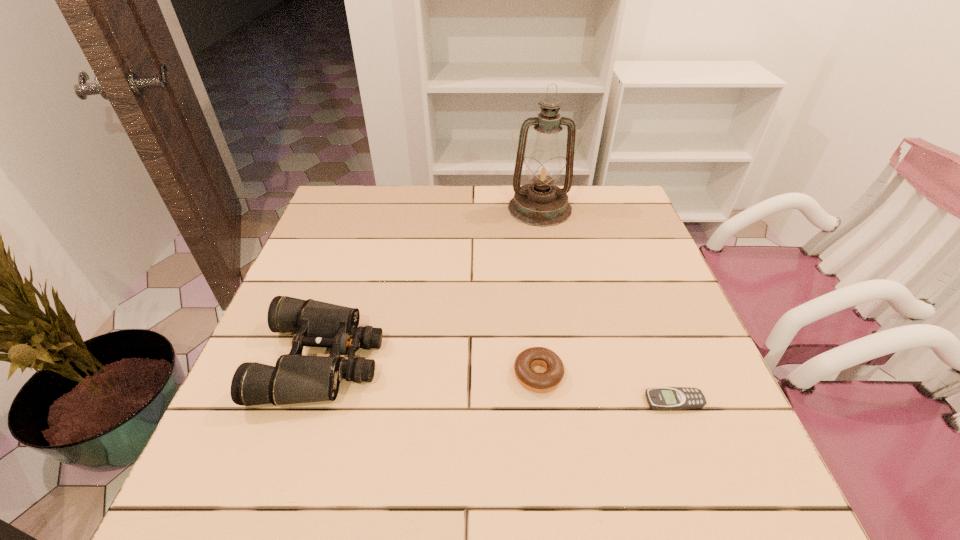
Locate an element on the screen. vacant space positioned 0.140m on the back of the rightmost object is located at coordinates (650, 338).

The width and height of the screenshot is (960, 540). In order to click on object that is at the far edge in this screenshot , I will do `click(540, 203)`.

This screenshot has width=960, height=540. I want to click on object located in the left edge section of the desktop, so click(x=296, y=378).

Locate an element on the screen. The width and height of the screenshot is (960, 540). object present at the right edge is located at coordinates (663, 398).

In the image, there is a desktop. Find the location of `free space at the far edge`. free space at the far edge is located at coordinates (387, 218).

You are a GUI agent. You are given a task and a screenshot of the screen. Output one action in this format:
    pyautogui.click(x=<x>, y=<y>)
    Task: Click on the blank space at the near edge of the desktop
    This screenshot has height=540, width=960.
    Given the screenshot: What is the action you would take?
    pyautogui.click(x=561, y=463)

In the image, there is a desktop. At what (x,y) coordinates should I click in order to perform the action: click on vacant space at the left edge. Please return your answer as a coordinate pair (x, y). Looking at the image, I should click on (300, 280).

Identify the location of free space at the right edge of the desktop. (695, 433).

I want to click on free space at the far left corner, so click(345, 201).

You are a GUI agent. You are given a task and a screenshot of the screen. Output one action in this format:
    pyautogui.click(x=<x>, y=<y>)
    Task: Click on the vacant space at the near left corner of the desktop
    The image size is (960, 540).
    Given the screenshot: What is the action you would take?
    pyautogui.click(x=263, y=489)